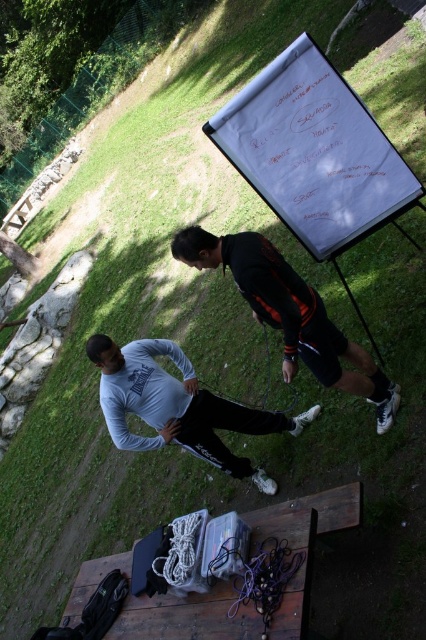
In the scene shown: You are organizing a small outdoor event and need to seat guests. The wooden picnic table at lower center and the black matte jacket at center are in the way. Which object should you move to free up more space?

The wooden picnic table at lower center should be moved because it has a larger size compared to the black matte jacket at center, freeing up more space.